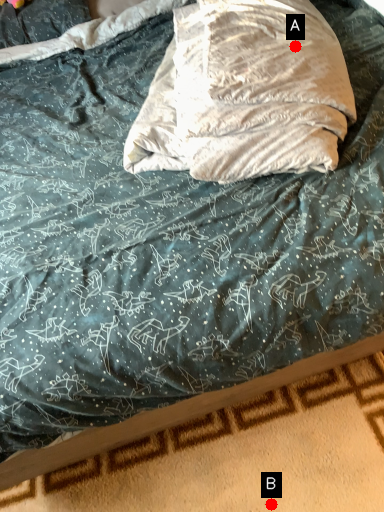
Question: Two points are circled on the image, labeled by A and B beside each circle. Which point is further to the camera?

Choices:
 (A) A is further
 (B) B is further

Answer: (A)